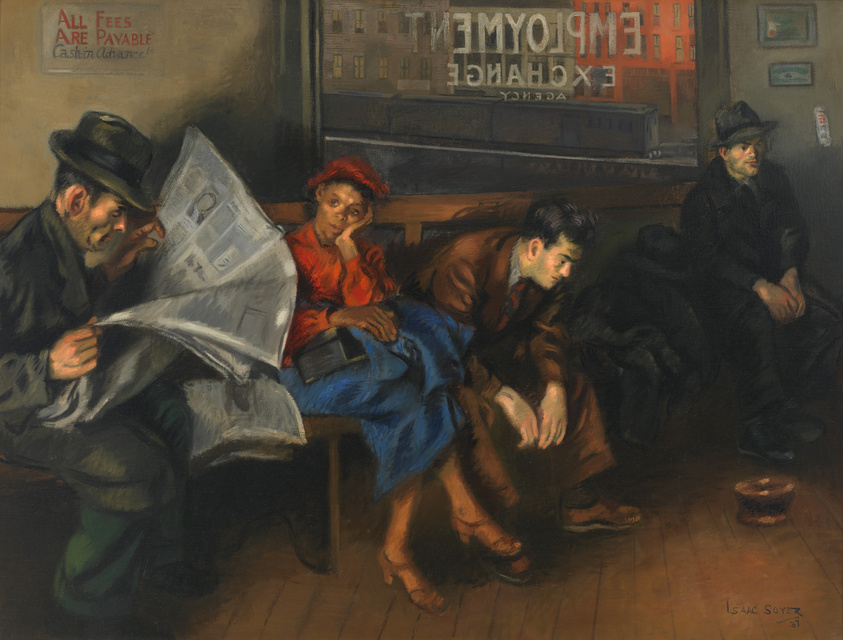
Image resolution: width=843 pixels, height=640 pixels. I want to click on newspapers, so click(x=249, y=419), click(x=215, y=272).